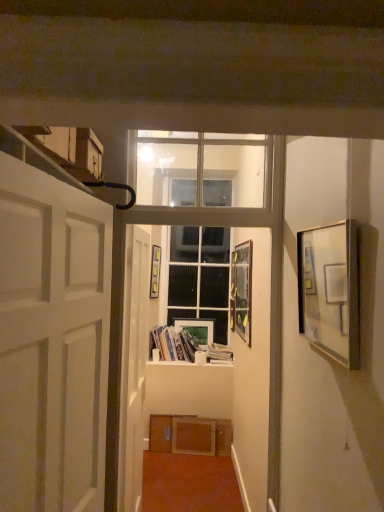
Question: Based on their sizes in the image, would you say matte glass picture frame at right, placed as the fourth picture frame when sorted from back to front, is bigger or smaller than white matte door at left, which is counted as the second door, starting from the back?

Choices:
 (A) small
 (B) big

Answer: (A)

Question: In terms of height, does matte glass picture frame at right, the 4th picture frame from the left, look taller or shorter compared to white matte door at left, the 1th door from the front?

Choices:
 (A) tall
 (B) short

Answer: (B)

Question: Based on their relative distances, which object is farther from the matte wooden picture frame at center, the 4th picture frame in the front-to-back sequence?

Choices:
 (A) matte glass picture frame at center, the 3th picture frame viewed from the back
 (B) matte gold picture frame at center, the third picture frame from the front
 (C) white matte door at left, which is counted as the second door, starting from the back
 (D) matte glass picture frame at right, placed as the fourth picture frame when sorted from back to front
 (E) white paper book at center, which ranks as the 2th book in left-to-right order

Answer: (C)

Question: Which of these objects is positioned closest to the clear glass window at upper center, which is the 1th window frame in top-to-bottom order?

Choices:
 (A) white wood window frame at center, which appears as the 1th window frame when viewed from the back
 (B) matte wooden picture frame at center, the 4th picture frame in the front-to-back sequence
 (C) wooden at center
 (D) white paper book at center, which ranks as the 2th book in left-to-right order
 (E) matte gold picture frame at center, arranged as the 4th picture frame when viewed from the right

Answer: (A)